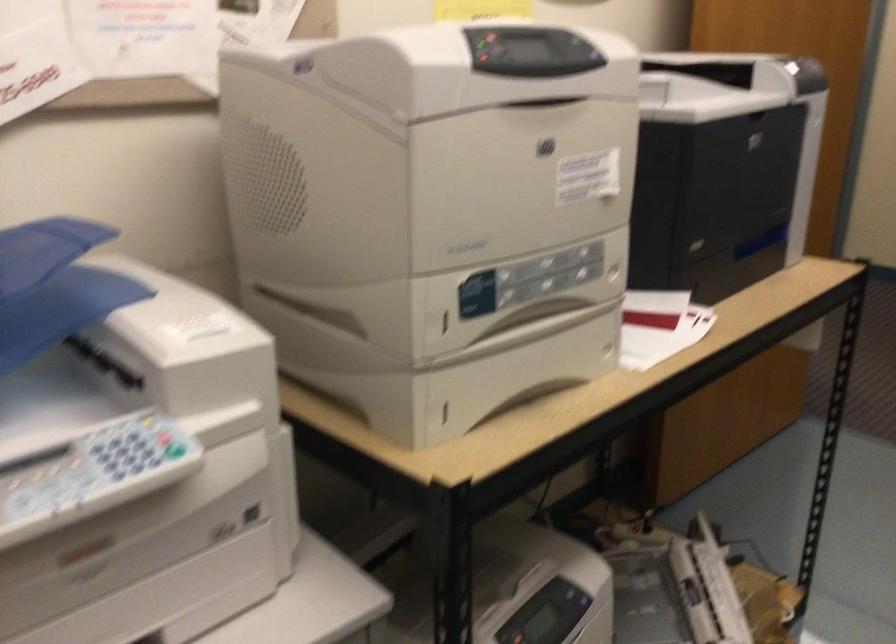
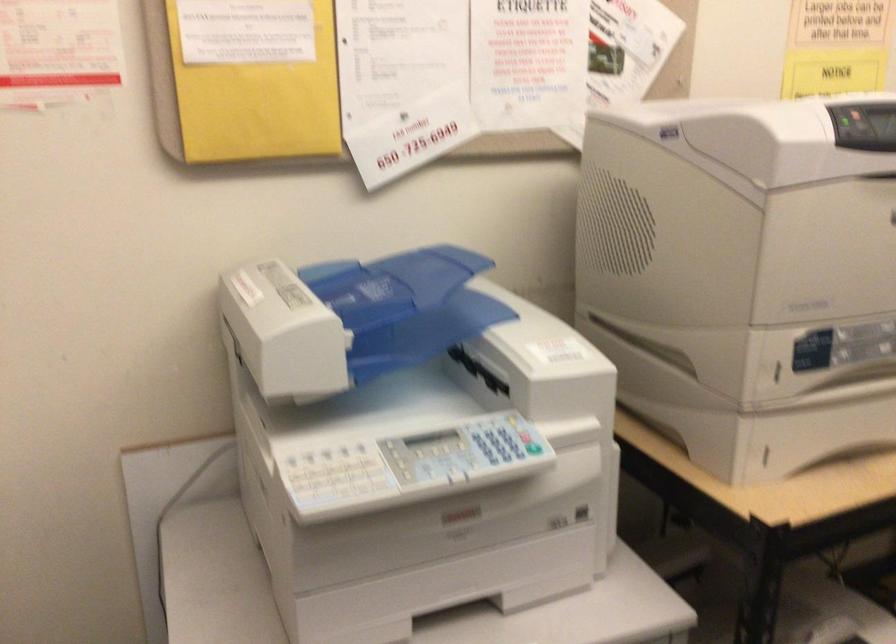
Find the pixel in the second image that matches (x=444, y=323) in the first image.

(777, 372)